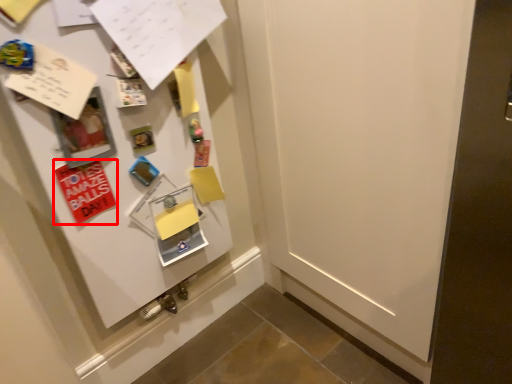
Question: Considering the relative positions of postcard (annotated by the red box) and paper in the image provided, where is postcard (annotated by the red box) located with respect to the staircase?

Choices:
 (A) right
 (B) left

Answer: (B)